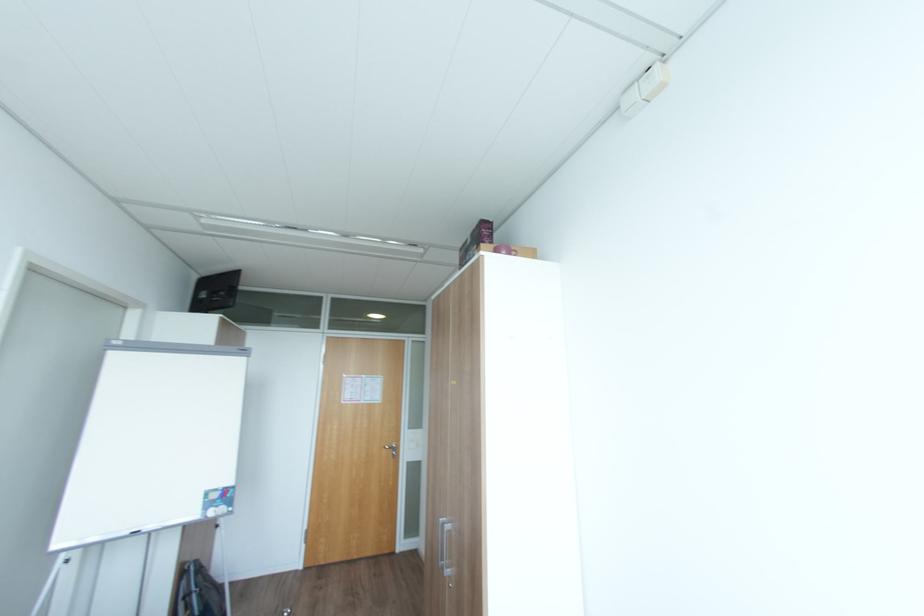
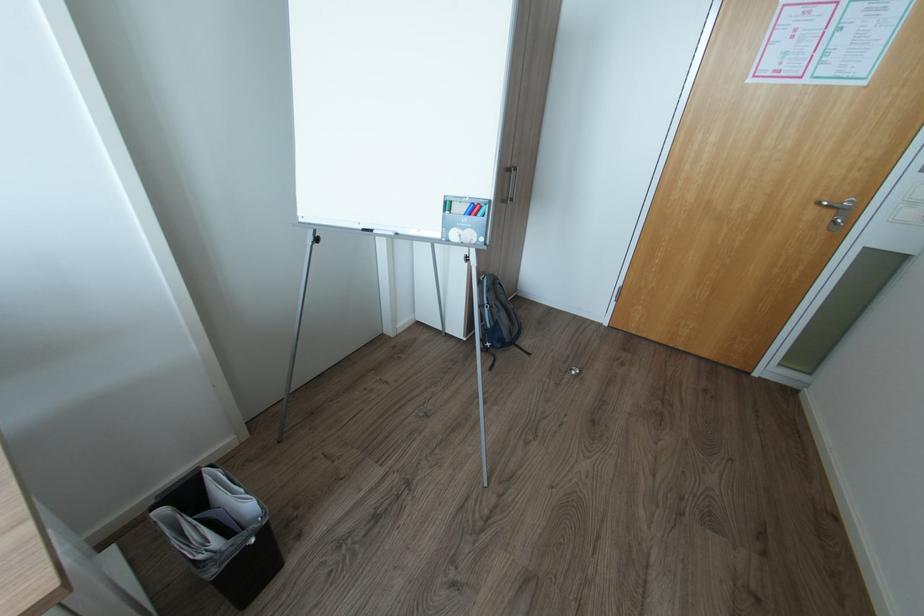
Locate, in the second image, the point that corresponds to (x=392, y=448) in the first image.

(830, 204)